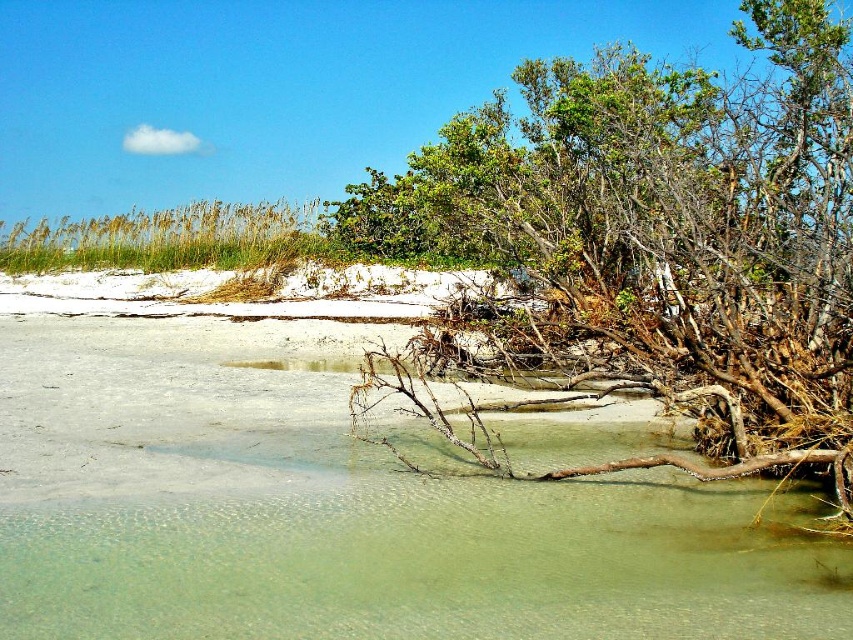
Question: Does brown/dry wood at center-right have a larger size compared to green grass at upper left?

Choices:
 (A) no
 (B) yes

Answer: (B)

Question: Does brown/dry wood at center-right appear under green grass at upper left?

Choices:
 (A) no
 (B) yes

Answer: (A)

Question: Among these points, which one is farthest from the camera?

Choices:
 (A) (619, 140)
 (B) (172, 266)

Answer: (B)

Question: Which object is farther from the camera taking this photo?

Choices:
 (A) brown/dry wood at center-right
 (B) green grass at upper left

Answer: (B)

Question: Does brown/dry wood at center-right have a lesser width compared to green grass at upper left?

Choices:
 (A) no
 (B) yes

Answer: (A)